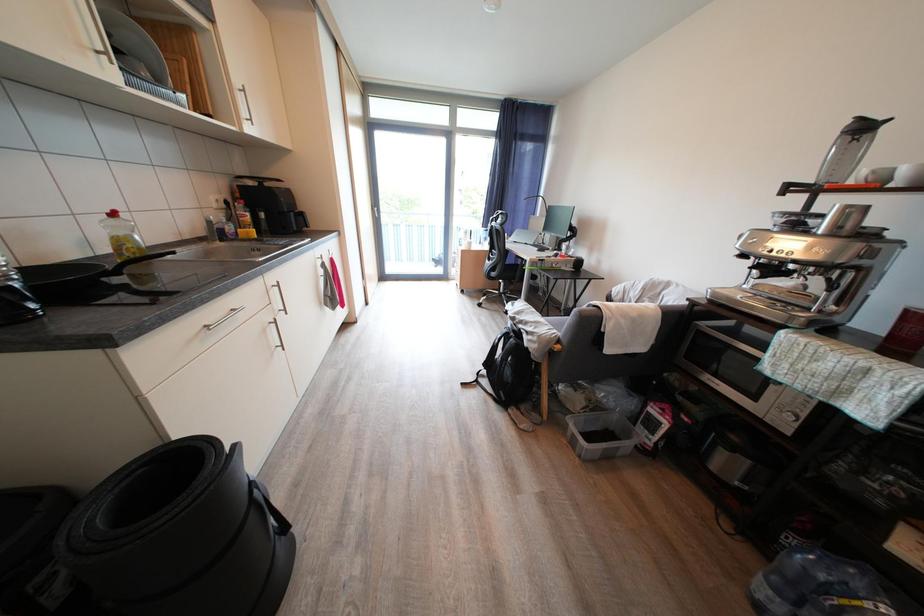
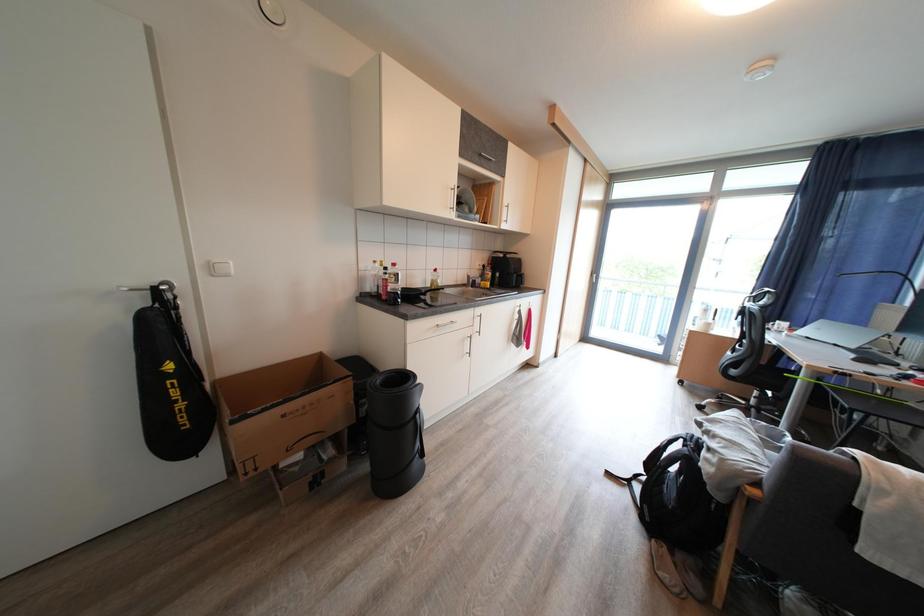
Question: The camera is either moving clockwise (left) or counter-clockwise (right) around the object. The first image is from the beginning of the video and the second image is from the end. Is the camera moving left or right when shooting the video?

Choices:
 (A) Left
 (B) Right

Answer: (B)